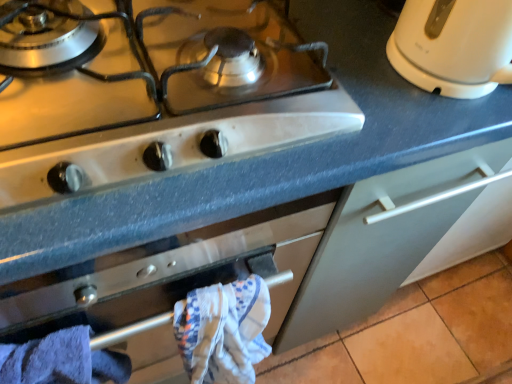
Identify the location of blue cotton bath towel at lower left, which appears as the second bath towel when viewed from the right. (62, 360).

Locate an element on the screen. The height and width of the screenshot is (384, 512). white textured bath towel at center, arranged as the 2th bath towel when viewed from the left is located at coordinates (223, 330).

The image size is (512, 384). What do you see at coordinates (142, 62) in the screenshot? I see `white glossy gas stove at upper left` at bounding box center [142, 62].

Identify the location of blue cotton bath towel at lower left, which appears as the second bath towel when viewed from the right. (62, 360).

Looking at the image, does white glossy gas stove at upper left seem bigger or smaller compared to white glossy electric kettle at upper right?

In the image, white glossy gas stove at upper left appears to be larger than white glossy electric kettle at upper right.

How much distance is there between white glossy gas stove at upper left and white glossy electric kettle at upper right?

They are 11.33 inches apart.

Is white glossy gas stove at upper left with white glossy electric kettle at upper right?

No, white glossy gas stove at upper left is not touching white glossy electric kettle at upper right.

Which is more to the left, white glossy gas stove at upper left or white glossy electric kettle at upper right?

white glossy gas stove at upper left.

Relative to blue cotton bath towel at lower left, placed as the first bath towel when sorted from left to right, is white textured bath towel at center, which is the first bath towel in right-to-left order, in front or behind?

Clearly, white textured bath towel at center, which is the first bath towel in right-to-left order, is behind blue cotton bath towel at lower left, placed as the first bath towel when sorted from left to right.

Can you tell me how much white textured bath towel at center, arranged as the 2th bath towel when viewed from the left, and blue cotton bath towel at lower left, which appears as the second bath towel when viewed from the right, differ in facing direction?

The angle between the facing direction of white textured bath towel at center, arranged as the 2th bath towel when viewed from the left, and the facing direction of blue cotton bath towel at lower left, which appears as the second bath towel when viewed from the right, is 0.000328 degrees.

Looking at their sizes, would you say white textured bath towel at center, which is the first bath towel in right-to-left order, is wider or thinner than blue cotton bath towel at lower left, placed as the first bath towel when sorted from left to right?

Clearly, white textured bath towel at center, which is the first bath towel in right-to-left order, has less width compared to blue cotton bath towel at lower left, placed as the first bath towel when sorted from left to right.

From the image's perspective, between white textured bath towel at center, arranged as the 2th bath towel when viewed from the left, and blue cotton bath towel at lower left, which appears as the second bath towel when viewed from the right, who is located below?

blue cotton bath towel at lower left, which appears as the second bath towel when viewed from the right, is shown below in the image.

From a real-world perspective, is blue cotton bath towel at lower left, placed as the first bath towel when sorted from left to right, positioned under white glossy gas stove at upper left based on gravity?

Yes, from a real-world perspective, blue cotton bath towel at lower left, placed as the first bath towel when sorted from left to right, is beneath white glossy gas stove at upper left.

From the image's perspective, is blue cotton bath towel at lower left, which appears as the second bath towel when viewed from the right, positioned above or below white glossy gas stove at upper left?

From the image's perspective, blue cotton bath towel at lower left, which appears as the second bath towel when viewed from the right, appears below white glossy gas stove at upper left.

In order to click on gas stove above the blue cotton bath towel at lower left, placed as the first bath towel when sorted from left to right (from a real-world perspective) in this screenshot , I will do `click(142, 62)`.

Is blue cotton bath towel at lower left, which appears as the second bath towel when viewed from the right, at the left side of white glossy gas stove at upper left?

Correct, you'll find blue cotton bath towel at lower left, which appears as the second bath towel when viewed from the right, to the left of white glossy gas stove at upper left.

From the image's perspective, which one is positioned lower, white glossy electric kettle at upper right or blue cotton bath towel at lower left, placed as the first bath towel when sorted from left to right?

blue cotton bath towel at lower left, placed as the first bath towel when sorted from left to right.

Is white glossy electric kettle at upper right further to the viewer compared to blue cotton bath towel at lower left, placed as the first bath towel when sorted from left to right?

Yes, white glossy electric kettle at upper right is further from the camera.

Does point (504, 25) appear closer or farther from the camera than point (20, 369)?

Point (504, 25) is closer to the camera than point (20, 369).

Does white glossy electric kettle at upper right have a smaller size compared to blue cotton bath towel at lower left, placed as the first bath towel when sorted from left to right?

Yes.

Is white glossy gas stove at upper left oriented towards blue cotton bath towel at lower left, placed as the first bath towel when sorted from left to right?

No, white glossy gas stove at upper left is not oriented towards blue cotton bath towel at lower left, placed as the first bath towel when sorted from left to right.

From the image's perspective, which is above, white glossy gas stove at upper left or blue cotton bath towel at lower left, placed as the first bath towel when sorted from left to right?

From the image's view, white glossy gas stove at upper left is above.

Are white glossy gas stove at upper left and blue cotton bath towel at lower left, placed as the first bath towel when sorted from left to right, located far from each other?

That's not correct — white glossy gas stove at upper left is a little close to blue cotton bath towel at lower left, placed as the first bath towel when sorted from left to right.

Image resolution: width=512 pixels, height=384 pixels. I want to click on the 1st bath towel directly beneath the white glossy gas stove at upper left (from a real-world perspective), so click(62, 360).

This screenshot has width=512, height=384. I want to click on kitchen appliance on the right of white glossy gas stove at upper left, so click(x=453, y=46).

From the image's perspective, does white glossy electric kettle at upper right appear lower than white glossy gas stove at upper left?

No.

Consider the image. Is white glossy electric kettle at upper right turned away from white glossy gas stove at upper left?

No, white glossy gas stove at upper left is not at the back of white glossy electric kettle at upper right.

From a real-world perspective, is white glossy electric kettle at upper right under white glossy gas stove at upper left?

No.

Is white glossy electric kettle at upper right completely or partially inside blue cotton bath towel at lower left, which appears as the second bath towel when viewed from the right?

No.

Between blue cotton bath towel at lower left, which appears as the second bath towel when viewed from the right, and white glossy electric kettle at upper right, which one has larger size?

blue cotton bath towel at lower left, which appears as the second bath towel when viewed from the right, is bigger.

From a real-world perspective, which is physically above, blue cotton bath towel at lower left, which appears as the second bath towel when viewed from the right, or white glossy electric kettle at upper right?

From a 3D spatial view, white glossy electric kettle at upper right is above.

Is blue cotton bath towel at lower left, placed as the first bath towel when sorted from left to right, at the left side of white glossy electric kettle at upper right?

Indeed, blue cotton bath towel at lower left, placed as the first bath towel when sorted from left to right, is positioned on the left side of white glossy electric kettle at upper right.

Where is `kitchen appliance on the right of white glossy gas stove at upper left`? The height and width of the screenshot is (384, 512). kitchen appliance on the right of white glossy gas stove at upper left is located at coordinates coord(453,46).

Identify the location of bath towel to the left of white textured bath towel at center, which is the first bath towel in right-to-left order. Image resolution: width=512 pixels, height=384 pixels. (62, 360).

Estimate the real-world distances between objects in this image. Which object is further from white textured bath towel at center, which is the first bath towel in right-to-left order, white glossy gas stove at upper left or white glossy electric kettle at upper right?

white glossy electric kettle at upper right lies further to white textured bath towel at center, which is the first bath towel in right-to-left order, than the other object.

Estimate the real-world distances between objects in this image. Which object is further from white textured bath towel at center, which is the first bath towel in right-to-left order, blue cotton bath towel at lower left, which appears as the second bath towel when viewed from the right, or white glossy electric kettle at upper right?

white glossy electric kettle at upper right lies further to white textured bath towel at center, which is the first bath towel in right-to-left order, than the other object.

When comparing their distances from white glossy electric kettle at upper right, does white textured bath towel at center, which is the first bath towel in right-to-left order, or blue cotton bath towel at lower left, which appears as the second bath towel when viewed from the right, seem closer?

white textured bath towel at center, which is the first bath towel in right-to-left order, lies closer to white glossy electric kettle at upper right than the other object.

From the image, which object appears to be farther from blue cotton bath towel at lower left, which appears as the second bath towel when viewed from the right, white glossy electric kettle at upper right or white glossy gas stove at upper left?

The object further to blue cotton bath towel at lower left, which appears as the second bath towel when viewed from the right, is white glossy electric kettle at upper right.

Which object lies nearer to the anchor point white glossy gas stove at upper left, blue cotton bath towel at lower left, placed as the first bath towel when sorted from left to right, or white glossy electric kettle at upper right?

white glossy electric kettle at upper right is positioned closer to the anchor white glossy gas stove at upper left.

Which object lies nearer to the anchor point blue cotton bath towel at lower left, which appears as the second bath towel when viewed from the right, white glossy electric kettle at upper right or white textured bath towel at center, arranged as the 2th bath towel when viewed from the left?

white textured bath towel at center, arranged as the 2th bath towel when viewed from the left.

Which object lies further to the anchor point white glossy gas stove at upper left, white glossy electric kettle at upper right or blue cotton bath towel at lower left, which appears as the second bath towel when viewed from the right?

blue cotton bath towel at lower left, which appears as the second bath towel when viewed from the right, lies further to white glossy gas stove at upper left than the other object.

Based on their spatial positions, is white glossy electric kettle at upper right or white textured bath towel at center, arranged as the 2th bath towel when viewed from the left, further from white glossy gas stove at upper left?

white textured bath towel at center, arranged as the 2th bath towel when viewed from the left.

This screenshot has height=384, width=512. I want to click on bath towel between blue cotton bath towel at lower left, placed as the first bath towel when sorted from left to right, and white glossy electric kettle at upper right from left to right, so click(x=223, y=330).

The image size is (512, 384). Identify the location of bath towel that lies between white glossy gas stove at upper left and blue cotton bath towel at lower left, which appears as the second bath towel when viewed from the right, from top to bottom. (223, 330).

At what (x,y) coordinates should I click in order to perform the action: click on gas stove located between blue cotton bath towel at lower left, placed as the first bath towel when sorted from left to right, and white glossy electric kettle at upper right in the left-right direction. Please return your answer as a coordinate pair (x, y). The width and height of the screenshot is (512, 384). Looking at the image, I should click on (142, 62).

This screenshot has width=512, height=384. I want to click on gas stove between white glossy electric kettle at upper right and white textured bath towel at center, arranged as the 2th bath towel when viewed from the left, vertically, so click(142, 62).